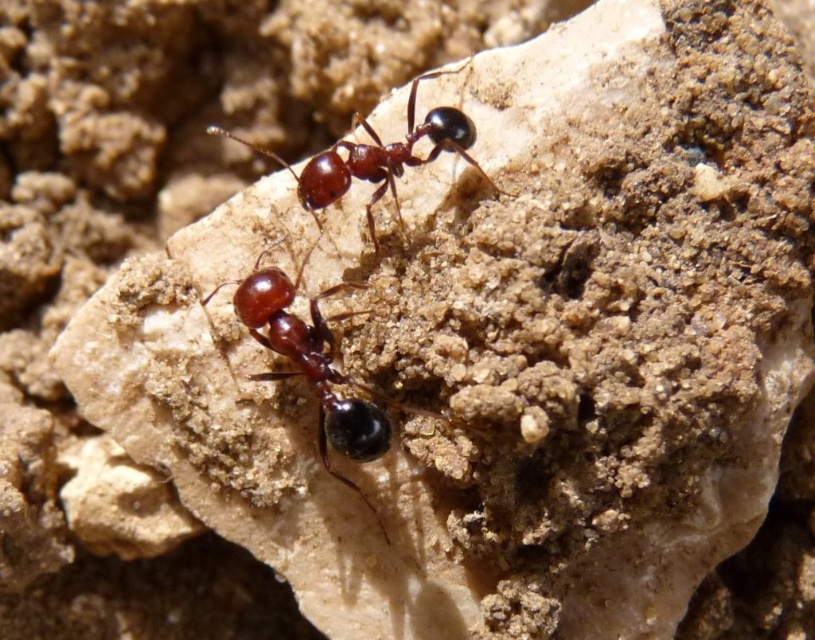
Question: Among these objects, which one is farthest from the camera?

Choices:
 (A) shiny brown ant at center
 (B) shiny brown ant at upper center

Answer: (B)

Question: Observing the image, what is the correct spatial positioning of shiny brown ant at center in reference to shiny brown ant at upper center?

Choices:
 (A) below
 (B) above

Answer: (A)

Question: Is shiny brown ant at center below shiny brown ant at upper center?

Choices:
 (A) no
 (B) yes

Answer: (B)

Question: Does shiny brown ant at center appear on the left side of shiny brown ant at upper center?

Choices:
 (A) yes
 (B) no

Answer: (A)

Question: Among these points, which one is nearest to the camera?

Choices:
 (A) (340, 429)
 (B) (289, 172)

Answer: (A)